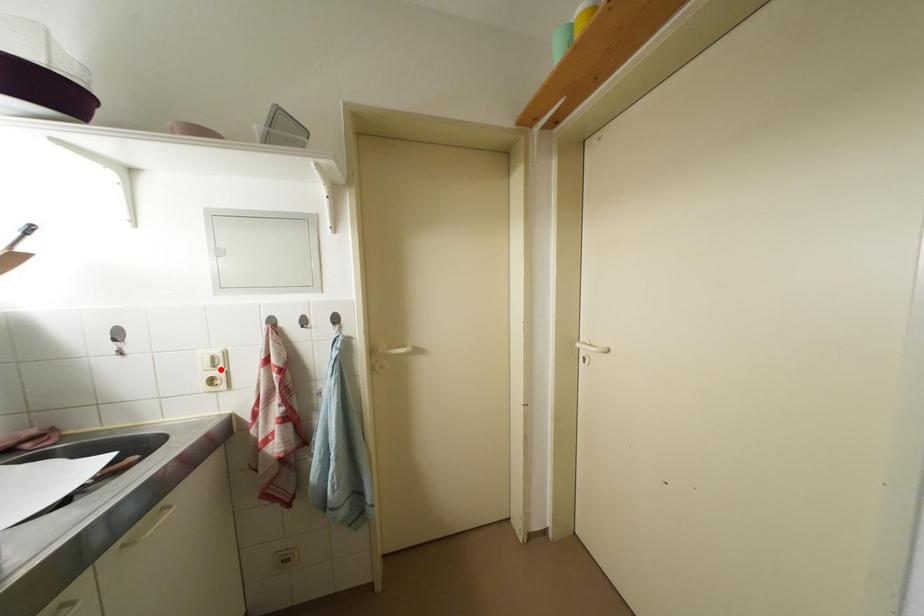
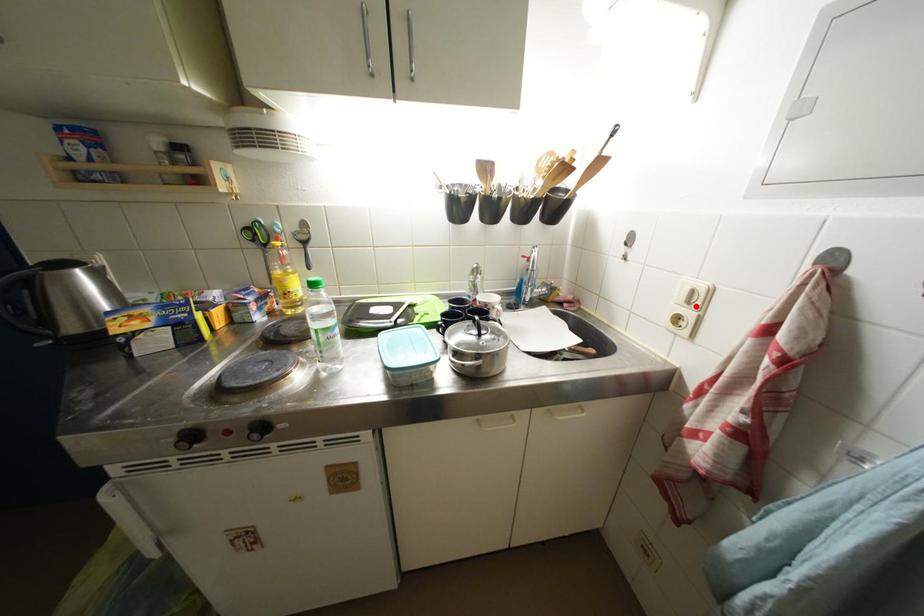
I am providing you with two images of the same scene from different viewpoints. A red point is marked on the first image and another point is marked on the second image. Is the red point in image1 aligned with the point shown in image2?

Yes